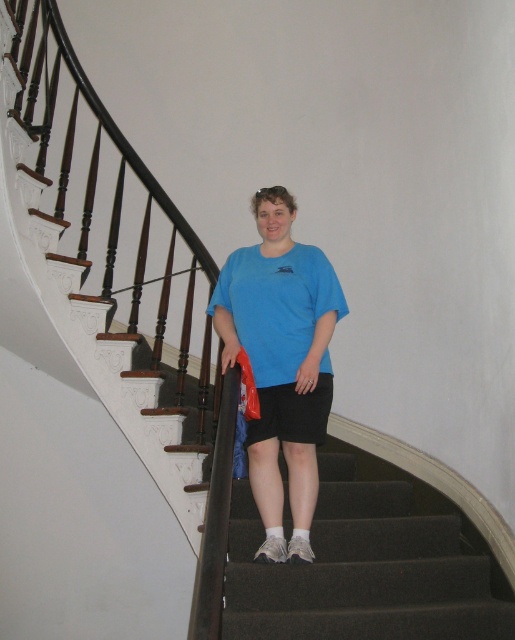
You are standing at the bottom of the staircase in the image. The dark gray carpet at center is represented by point [367,563]. If you want to step onto the dark gray carpet at center, which direction should you move relative to your current position?

The dark gray carpet at center is located at point [367,563], so you should move towards the center of the staircase to step onto it.